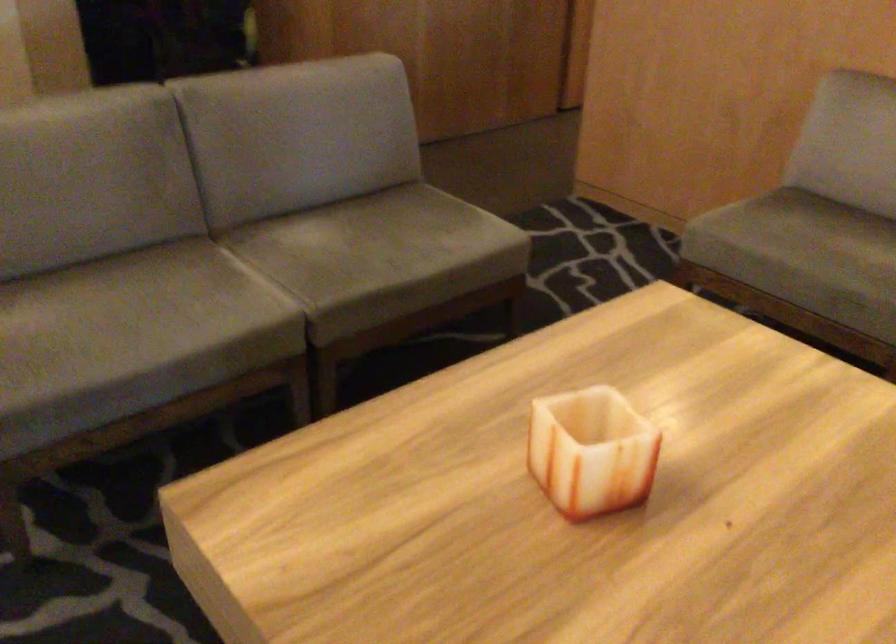
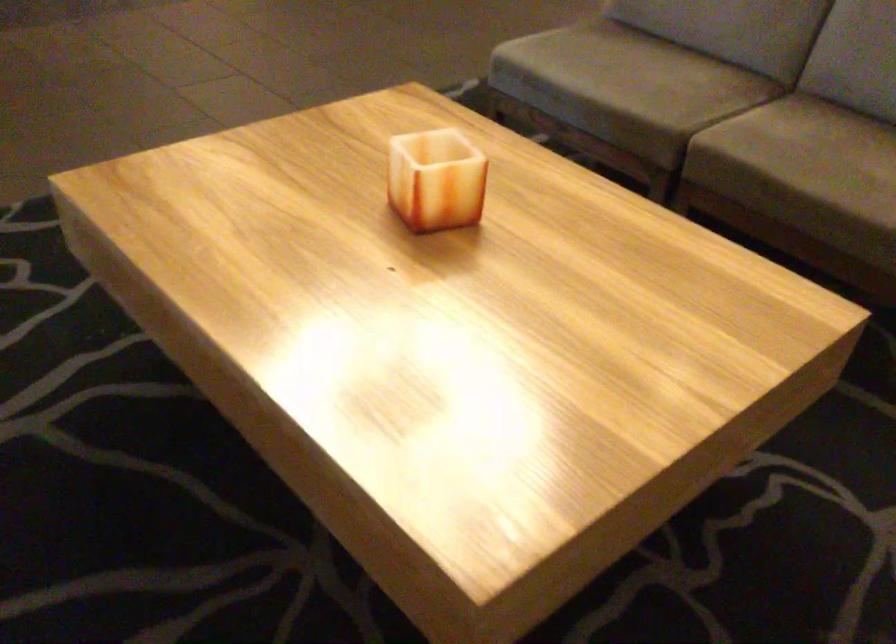
Find the pixel in the second image that matches pixel 165 327 in the first image.

(622, 80)